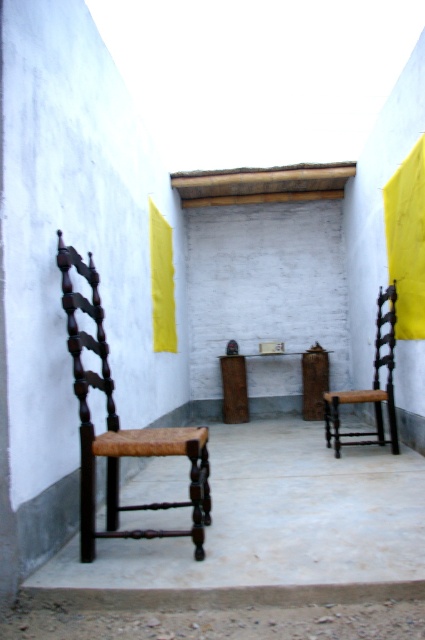
Question: Considering the real-world distances, which object is closest to the yellow fabric curtain at right?

Choices:
 (A) yellow fabric curtain at center
 (B) dark brown wood chair at left
 (C) dark brown wood chair at right

Answer: (C)

Question: Estimate the real-world distances between objects in this image. Which object is closer to the dark brown wood chair at left?

Choices:
 (A) yellow fabric curtain at right
 (B) dark brown wood chair at right
 (C) yellow fabric curtain at center

Answer: (B)

Question: Which object is the closest to the yellow fabric curtain at center?

Choices:
 (A) yellow fabric curtain at right
 (B) dark brown wood chair at right

Answer: (B)

Question: Can you confirm if dark brown wood chair at left is thinner than yellow fabric curtain at right?

Choices:
 (A) no
 (B) yes

Answer: (A)

Question: Can you confirm if dark brown wood chair at left is smaller than dark brown wood chair at right?

Choices:
 (A) yes
 (B) no

Answer: (A)

Question: Can you confirm if dark brown wood chair at right is bigger than yellow fabric curtain at center?

Choices:
 (A) yes
 (B) no

Answer: (A)